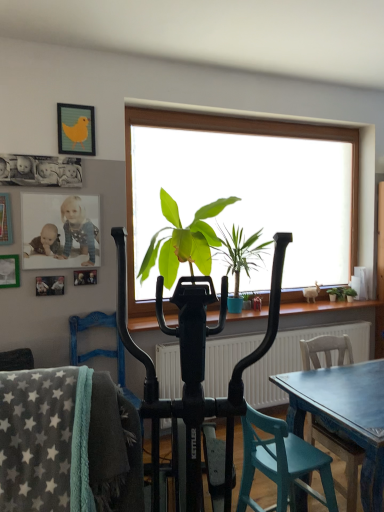
What is the approximate width of wooden picture frame at upper left, which is the 2th picture frame from top to bottom?

1.08 inches.

What do you see at coordinates (339, 456) in the screenshot? The width and height of the screenshot is (384, 512). I see `wooden chair at lower right, which ranks as the 3th chair in front-to-back order` at bounding box center [339, 456].

The width and height of the screenshot is (384, 512). In order to click on green leafy plant at center, the second houseplant viewed from the right in this screenshot , I will do `click(239, 258)`.

The height and width of the screenshot is (512, 384). What do you see at coordinates (239, 258) in the screenshot?
I see `green leafy plant at center, the second houseplant viewed from the right` at bounding box center [239, 258].

In order to face black plastic exercise bike at center, should I rotate leftwards or rightwards?

A 0.158 degree turn to the right will do.

How much space does green leafy plant at right, which is counted as the 3th houseplant, starting from the left, occupy vertically?

green leafy plant at right, which is counted as the 3th houseplant, starting from the left, is 5.26 inches in height.

Identify the location of wooden picture frame at upper left, the 3th picture frame from the bottom. (5, 220).

Identify the location of feeding chair in front of the green leafy plant at center, which appears as the 2th houseplant when viewed from the left. The image size is (384, 512). (181, 370).

Based on their positions, is green leafy plant at center, which appears as the 2th houseplant when viewed from the left, located to the left or right of black plastic exercise bike at center?

Clearly, green leafy plant at center, which appears as the 2th houseplant when viewed from the left, is on the right of black plastic exercise bike at center in the image.

Is green leafy plant at center, the second houseplant viewed from the right, oriented towards black plastic exercise bike at center?

No, green leafy plant at center, the second houseplant viewed from the right, is not oriented towards black plastic exercise bike at center.

How many degrees apart are the facing directions of yellow fabric picture frame at upper left, marked as the 1th picture frame in a top-to-bottom arrangement, and wooden chair at lower right, the first chair in the right-to-left sequence?

There is a 1.14-degree angle between the facing directions of yellow fabric picture frame at upper left, marked as the 1th picture frame in a top-to-bottom arrangement, and wooden chair at lower right, the first chair in the right-to-left sequence.

Is yellow fabric picture frame at upper left, acting as the fourth picture frame starting from the bottom, in front of wooden chair at lower right, which is the 1th chair from back to front?

No, yellow fabric picture frame at upper left, acting as the fourth picture frame starting from the bottom, is behind wooden chair at lower right, which is the 1th chair from back to front.

From a real-world perspective, which is physically below, yellow fabric picture frame at upper left, marked as the 1th picture frame in a top-to-bottom arrangement, or wooden chair at lower right, the first chair in the right-to-left sequence?

From a 3D spatial view, wooden chair at lower right, the first chair in the right-to-left sequence, is below.

Is the surface of gray fleece blanket at lower left, which is the 3th chair from right to left, in direct contact with wooden picture frame at upper left, which is the 2th picture frame from top to bottom?

No, gray fleece blanket at lower left, which is the 3th chair from right to left, is not next to wooden picture frame at upper left, which is the 2th picture frame from top to bottom.

This screenshot has height=512, width=384. Identify the location of chair that is the 1st object directly below the wooden picture frame at upper left, which is the 2th picture frame from top to bottom (from a real-world perspective). (37, 437).

Between point (57, 406) and point (10, 203), which one is positioned behind?

The point (10, 203) is farther.

Visually, is gray fleece blanket at lower left, which appears as the first chair when viewed from the left, positioned to the left or to the right of wooden picture frame at upper left, which is the 2th picture frame from top to bottom?

gray fleece blanket at lower left, which appears as the first chair when viewed from the left, is positioned on wooden picture frame at upper left, which is the 2th picture frame from top to bottom,'s right side.

Could you tell me if gray fleece blanket at lower left, placed as the 3th chair when sorted from back to front, is turned towards black plastic exercise bike at center?

No, gray fleece blanket at lower left, placed as the 3th chair when sorted from back to front, is not facing towards black plastic exercise bike at center.

From the image's perspective, is gray fleece blanket at lower left, which is the 3th chair from right to left, below black plastic exercise bike at center?

No, from the image's perspective, gray fleece blanket at lower left, which is the 3th chair from right to left, is not beneath black plastic exercise bike at center.

Is gray fleece blanket at lower left, placed as the 3th chair when sorted from back to front, inside or outside of black plastic exercise bike at center?

gray fleece blanket at lower left, placed as the 3th chair when sorted from back to front, exists outside the volume of black plastic exercise bike at center.

Which point is more forward, (x=44, y=466) or (x=120, y=280)?

Point (x=44, y=466)

Can you tell me how much black plastic exercise bike at center and green leafy plant at center, the first houseplant in the left-to-right sequence, differ in facing direction?

There is a 20.7-degree angle between the facing directions of black plastic exercise bike at center and green leafy plant at center, the first houseplant in the left-to-right sequence.

In the image, is black plastic exercise bike at center positioned in front of or behind green leafy plant at center, positioned as the 3th houseplant in right-to-left order?

Clearly, black plastic exercise bike at center is in front of green leafy plant at center, positioned as the 3th houseplant in right-to-left order.

Between black plastic exercise bike at center and green leafy plant at center, the first houseplant in the left-to-right sequence, which one has less height?

With less height is green leafy plant at center, the first houseplant in the left-to-right sequence.

Is point (56, 200) positioned in front of point (321, 477)?

No.

Is teal wood chair at lower right, marked as the 2th chair in a right-to-left arrangement, at the back of matte plastic photo frame at upper left, the 3th picture frame when ordered from top to bottom?

That's not correct — matte plastic photo frame at upper left, the 3th picture frame when ordered from top to bottom, is not looking away from teal wood chair at lower right, marked as the 2th chair in a right-to-left arrangement.

Can you confirm if matte plastic photo frame at upper left, which ranks as the second picture frame in bottom-to-top order, is shorter than teal wood chair at lower right, which is counted as the second chair, starting from the back?

Yes.

Which picture frame is the 2nd one when counting from the left side of the teal wood chair at lower right, marked as the 2th chair in a right-to-left arrangement? Please provide its 2D coordinates.

[(60, 231)]

In the scene shown: Is yellow fabric picture frame at upper left, acting as the fourth picture frame starting from the bottom, positioned far away from green leafy plant at center, the first houseplant in the left-to-right sequence?

No.

Is the depth of yellow fabric picture frame at upper left, marked as the 1th picture frame in a top-to-bottom arrangement, less than that of green leafy plant at center, the first houseplant in the left-to-right sequence?

Yes, it is.

Does point (62, 127) come closer to viewer compared to point (210, 269)?

Yes, point (62, 127) is in front of point (210, 269).

Is yellow fabric picture frame at upper left, marked as the 1th picture frame in a top-to-bottom arrangement, to the left of green leafy plant at center, positioned as the 3th houseplant in right-to-left order, from the viewer's perspective?

Yes.

Where is `feeding chair below the green leafy plant at center, the second houseplant viewed from the right (from the image's perspective)`? The width and height of the screenshot is (384, 512). feeding chair below the green leafy plant at center, the second houseplant viewed from the right (from the image's perspective) is located at coordinates (181, 370).

Where is `the 1st picture frame counting from the left side of the wooden chair at lower right, which ranks as the 3th chair in front-to-back order`? the 1st picture frame counting from the left side of the wooden chair at lower right, which ranks as the 3th chair in front-to-back order is located at coordinates (76, 129).

Which object lies nearer to the anchor point gray fleece blanket at lower left, which appears as the first chair when viewed from the left, yellow fabric picture frame at upper left, acting as the fourth picture frame starting from the bottom, or matte plastic photo frame at upper left, the 3th picture frame when ordered from top to bottom?

Based on the image, matte plastic photo frame at upper left, the 3th picture frame when ordered from top to bottom, appears to be nearer to gray fleece blanket at lower left, which appears as the first chair when viewed from the left.

From the image, which object appears to be farther from matte green picture frame at upper left, which ranks as the first picture frame in bottom-to-top order, yellow fabric picture frame at upper left, marked as the 1th picture frame in a top-to-bottom arrangement, or gray fleece blanket at lower left, placed as the 3th chair when sorted from back to front?

gray fleece blanket at lower left, placed as the 3th chair when sorted from back to front, lies further to matte green picture frame at upper left, which ranks as the first picture frame in bottom-to-top order, than the other object.

When comparing their distances from yellow fabric picture frame at upper left, acting as the fourth picture frame starting from the bottom, does green leafy plant at center, positioned as the 3th houseplant in right-to-left order, or wooden chair at lower right, which ranks as the 3th chair in front-to-back order, seem closer?

The object closer to yellow fabric picture frame at upper left, acting as the fourth picture frame starting from the bottom, is green leafy plant at center, positioned as the 3th houseplant in right-to-left order.

Based on their spatial positions, is yellow fabric picture frame at upper left, acting as the fourth picture frame starting from the bottom, or black plastic exercise bike at center further from green leafy plant at right, the 1th houseplant from the right?

The object further to green leafy plant at right, the 1th houseplant from the right, is yellow fabric picture frame at upper left, acting as the fourth picture frame starting from the bottom.

Considering their positions, is teal wood chair at lower right, which is counted as the second chair, starting from the back, positioned closer to black plastic exercise bike at center than yellow fabric picture frame at upper left, acting as the fourth picture frame starting from the bottom?

teal wood chair at lower right, which is counted as the second chair, starting from the back, is closer to black plastic exercise bike at center.

When comparing their distances from matte green picture frame at upper left, which is counted as the 4th picture frame, starting from the top, does green leafy plant at center, which appears as the 2th houseplant when viewed from the left, or gray fleece blanket at lower left, placed as the 1th chair when sorted from front to back, seem closer?

green leafy plant at center, which appears as the 2th houseplant when viewed from the left.

Considering their positions, is green leafy plant at center, the second houseplant viewed from the right, positioned further to teal wood chair at lower right, which is counted as the 2th chair, starting from the left, than gray fleece blanket at lower left, which appears as the first chair when viewed from the left?

The object further to teal wood chair at lower right, which is counted as the 2th chair, starting from the left, is green leafy plant at center, the second houseplant viewed from the right.

Which object lies further to the anchor point teal wood chair at lower right, the second chair when ordered from front to back, green leafy plant at center, which appears as the 2th houseplant when viewed from the left, or matte plastic photo frame at upper left, which ranks as the second picture frame in bottom-to-top order?

matte plastic photo frame at upper left, which ranks as the second picture frame in bottom-to-top order, is further to teal wood chair at lower right, the second chair when ordered from front to back.

Identify the location of houseplant located between yellow fabric picture frame at upper left, acting as the fourth picture frame starting from the bottom, and green leafy plant at center, which appears as the 2th houseplant when viewed from the left, in the left-right direction. (183, 240).

Where is `chair situated between wooden picture frame at upper left, which is the 2th picture frame from top to bottom, and teal wood chair at lower right, which is counted as the 2th chair, starting from the left, from left to right`? Image resolution: width=384 pixels, height=512 pixels. chair situated between wooden picture frame at upper left, which is the 2th picture frame from top to bottom, and teal wood chair at lower right, which is counted as the 2th chair, starting from the left, from left to right is located at coordinates (37, 437).

In order to click on picture frame located between gray fleece blanket at lower left, which appears as the first chair when viewed from the left, and matte green picture frame at upper left, which is counted as the 4th picture frame, starting from the top, in the depth direction in this screenshot , I will do `click(5, 220)`.

At what (x,y) coordinates should I click in order to perform the action: click on houseplant between matte green picture frame at upper left, which is counted as the 4th picture frame, starting from the top, and green leafy plant at center, which appears as the 2th houseplant when viewed from the left, in the horizontal direction. Please return your answer as a coordinate pair (x, y). This screenshot has height=512, width=384. Looking at the image, I should click on (183, 240).